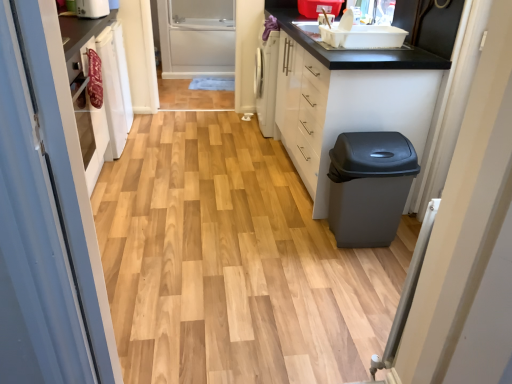
The image size is (512, 384). What are the coordinates of `empty space that is ontop of wooden floor at center` in the screenshot? It's located at (228, 210).